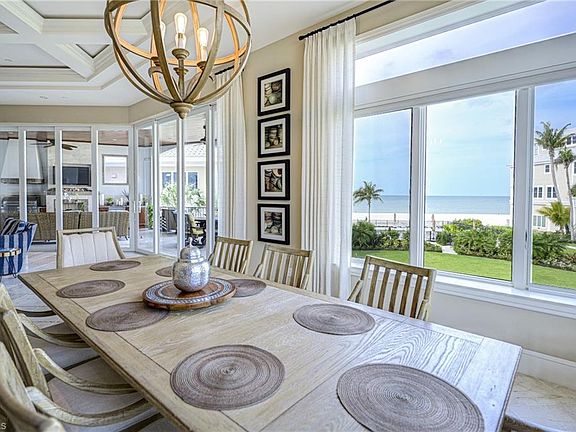
The image size is (576, 432). In order to click on place mat in this screenshot , I will do `click(397, 380)`.